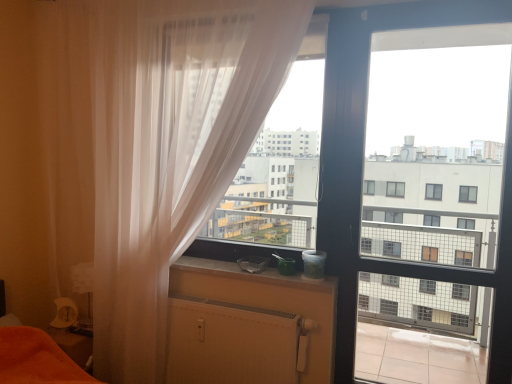
Measure the distance between translucent white curtain at left and camera.

translucent white curtain at left and camera are 1.97 meters apart from each other.

The width and height of the screenshot is (512, 384). What do you see at coordinates (234, 343) in the screenshot? I see `white matte radiator at lower center` at bounding box center [234, 343].

What do you see at coordinates (236, 276) in the screenshot? The width and height of the screenshot is (512, 384). I see `smooth concrete window sill at center` at bounding box center [236, 276].

At what (x,y) coordinates should I click in order to perform the action: click on transparent plastic window screen at center. Please return your answer as a coordinate pair (x, y). This screenshot has width=512, height=384. Looking at the image, I should click on (279, 160).

Where is `translucent white curtain at left`? This screenshot has height=384, width=512. translucent white curtain at left is located at coordinates (175, 154).

Identify the location of window screen lying behind the transparent glass screen door at center. (279, 160).

Which is in front, point (477, 262) or point (247, 164)?

The point (247, 164) is in front.

From a real-world perspective, which is physically below, transparent glass screen door at center or transparent plastic window screen at center?

In real-world perspective, transparent glass screen door at center is lower.

Could you measure the distance between transparent glass screen door at center and white matte radiator at lower center?

transparent glass screen door at center is 4.70 feet away from white matte radiator at lower center.

Is transparent glass screen door at center spatially inside white matte radiator at lower center, or outside of it?

transparent glass screen door at center is located beyond the bounds of white matte radiator at lower center.

From a real-world perspective, which object stands above the other?

transparent glass screen door at center, from a real-world perspective.

From the image's perspective, is transparent glass screen door at center located above white matte radiator at lower center?

Yes, from the image's perspective, transparent glass screen door at center is over white matte radiator at lower center.

From the image's perspective, is white matte radiator at lower center under transparent plastic window screen at center?

Yes.

How different are the orientations of white matte radiator at lower center and transparent plastic window screen at center in degrees?

0.0398 degrees.

Which of these two, white matte radiator at lower center or transparent plastic window screen at center, is bigger?

transparent plastic window screen at center.

From a real-world perspective, which object rests below the other?

white matte radiator at lower center, from a real-world perspective.

From the image's perspective, is translucent white curtain at left on transparent plastic window screen at center?

Incorrect, from the image's perspective, translucent white curtain at left is lower than transparent plastic window screen at center.

Measure the distance between translucent white curtain at left and transparent plastic window screen at center.

They are 22.69 inches apart.

Does translucent white curtain at left come behind transparent plastic window screen at center?

No, translucent white curtain at left is closer to the viewer.

Is translucent white curtain at left directly adjacent to transparent plastic window screen at center?

No, translucent white curtain at left is not touching transparent plastic window screen at center.

Identify the location of window screen that appears behind the smooth concrete window sill at center. This screenshot has width=512, height=384. (279, 160).

Is smooth concrete window sill at center positioned with its back to transparent plastic window screen at center?

No, smooth concrete window sill at center is not facing the opposite direction of transparent plastic window screen at center.

Are smooth concrete window sill at center and transparent plastic window screen at center far apart?

No, smooth concrete window sill at center is not far away from transparent plastic window screen at center.

Would you say smooth concrete window sill at center is inside or outside transparent plastic window screen at center?

The correct answer is: outside.

Where is `window sill below the transparent glass screen door at center (from the image's perspective)`? window sill below the transparent glass screen door at center (from the image's perspective) is located at coordinates (236, 276).

Is smooth concrete window sill at center facing towards transparent glass screen door at center?

No, smooth concrete window sill at center is not turned towards transparent glass screen door at center.

Which is more to the right, smooth concrete window sill at center or transparent glass screen door at center?

Positioned to the right is transparent glass screen door at center.

Is smooth concrete window sill at center outside of transparent glass screen door at center?

Absolutely, smooth concrete window sill at center is external to transparent glass screen door at center.

Who is bigger, transparent plastic window screen at center or transparent glass screen door at center?

transparent glass screen door at center.

Would you say transparent plastic window screen at center is to the left or to the right of transparent glass screen door at center in the picture?

transparent plastic window screen at center is to the left of transparent glass screen door at center.

Is transparent plastic window screen at center further to camera compared to transparent glass screen door at center?

Yes.

Find the location of a particular element. The image size is (512, 384). screen door on the right of the transparent plastic window screen at center is located at coordinates click(x=450, y=222).

The height and width of the screenshot is (384, 512). Identify the location of screen door located above the white matte radiator at lower center (from the image's perspective). (450, 222).

Based on their spatial positions, is translucent white curtain at left or smooth concrete window sill at center closer to transparent plastic window screen at center?

translucent white curtain at left lies closer to transparent plastic window screen at center than the other object.

Which object lies further to the anchor point transparent glass screen door at center, transparent plastic window screen at center or translucent white curtain at left?

translucent white curtain at left is positioned further to the anchor transparent glass screen door at center.

Considering their positions, is translucent white curtain at left positioned further to transparent glass screen door at center than transparent plastic window screen at center?

translucent white curtain at left.

Based on their spatial positions, is transparent glass screen door at center or translucent white curtain at left further from white matte radiator at lower center?

Based on the image, transparent glass screen door at center appears to be further to white matte radiator at lower center.

Looking at the image, which one is located closer to smooth concrete window sill at center, translucent white curtain at left or transparent plastic window screen at center?

transparent plastic window screen at center.

Based on their spatial positions, is white matte radiator at lower center or smooth concrete window sill at center closer to transparent plastic window screen at center?

Among the two, smooth concrete window sill at center is located nearer to transparent plastic window screen at center.

From the image, which object appears to be nearer to smooth concrete window sill at center, white matte radiator at lower center or translucent white curtain at left?

The object closer to smooth concrete window sill at center is white matte radiator at lower center.

Considering their positions, is translucent white curtain at left positioned closer to smooth concrete window sill at center than white matte radiator at lower center?

white matte radiator at lower center is positioned closer to the anchor smooth concrete window sill at center.

This screenshot has height=384, width=512. Identify the location of window screen situated between translucent white curtain at left and transparent glass screen door at center from left to right. (279, 160).

The width and height of the screenshot is (512, 384). In order to click on window sill between transparent plastic window screen at center and white matte radiator at lower center vertically in this screenshot , I will do `click(236, 276)`.

The height and width of the screenshot is (384, 512). I want to click on curtain that lies between transparent plastic window screen at center and white matte radiator at lower center from top to bottom, so click(175, 154).

Locate an element on the screen. This screenshot has height=384, width=512. window sill between translucent white curtain at left and transparent glass screen door at center is located at coordinates (236, 276).